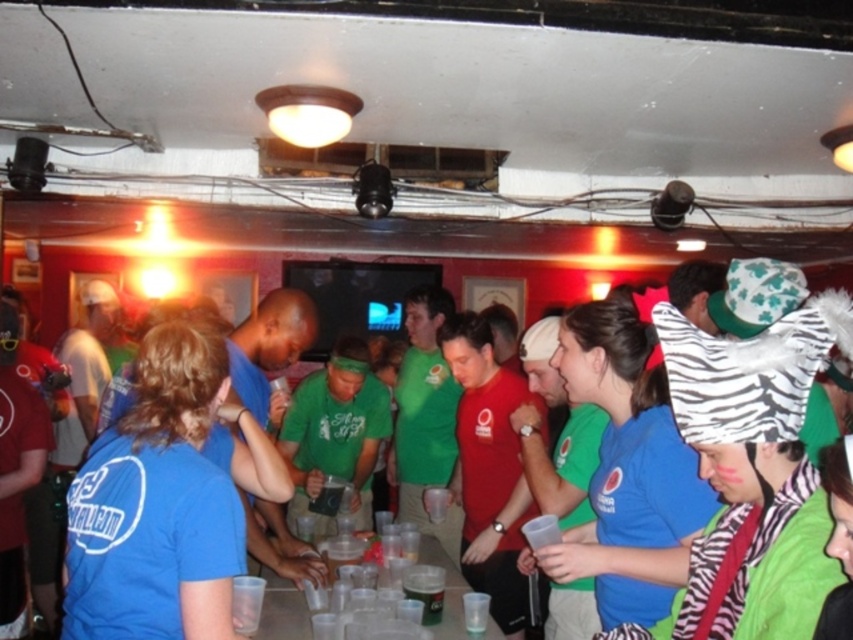
Question: Among these points, which one is nearest to the camera?

Choices:
 (A) (805, 428)
 (B) (402, 582)

Answer: (B)

Question: Is blue fabric shirt at center to the left of black plastic cup at center from the viewer's perspective?

Choices:
 (A) no
 (B) yes

Answer: (A)

Question: Which object is closer to the camera taking this photo?

Choices:
 (A) blue fabric shirt at center
 (B) black plastic cup at center

Answer: (A)

Question: Is blue fabric shirt at center thinner than black plastic cup at center?

Choices:
 (A) no
 (B) yes

Answer: (A)

Question: Among these points, which one is nearest to the camera?

Choices:
 (A) (418, 564)
 (B) (825, 276)

Answer: (A)

Question: Can you confirm if blue fabric shirt at center is positioned to the left of black plastic cup at center?

Choices:
 (A) no
 (B) yes

Answer: (A)